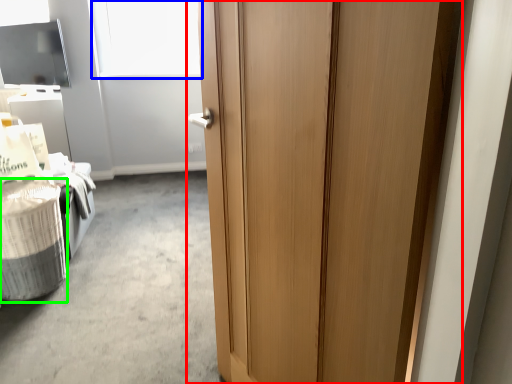
Question: Considering the real-world distances, which object is closest to door (highlighted by a red box)? window screen (highlighted by a blue box) or laundry basket (highlighted by a green box).

Choices:
 (A) window screen
 (B) laundry basket

Answer: (B)